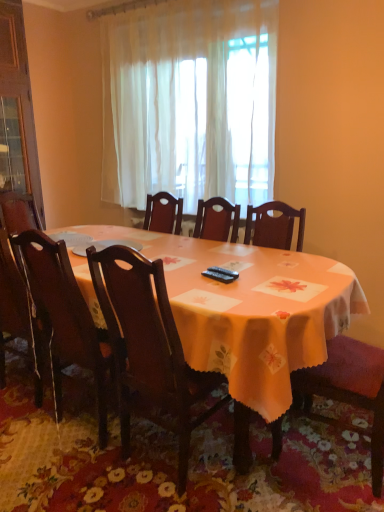
Locate an element on the screen. This screenshot has height=512, width=384. dark wood chair at left, which ranks as the first chair in left-to-right order is located at coordinates (67, 318).

Find the location of a particular element. wooden chair at right, the first chair when ordered from right to left is located at coordinates (348, 388).

Identify the location of dark wood chair at center, the second chair when ordered from right to left. (148, 348).

This screenshot has height=512, width=384. I want to click on dark wood chair at left, the 3th chair positioned from the right, so click(x=67, y=318).

Does floral fabric tablecloth at center contain dark wood chair at left, the 3th chair positioned from the right?

No, dark wood chair at left, the 3th chair positioned from the right, is not surrounded by floral fabric tablecloth at center.

How many degrees apart are the facing directions of floral fabric tablecloth at center and dark wood chair at left, which ranks as the first chair in left-to-right order?

The angular difference between floral fabric tablecloth at center and dark wood chair at left, which ranks as the first chair in left-to-right order, is 180 degrees.

Locate an element on the screen. mat below the dark wood chair at left, which ranks as the first chair in left-to-right order (from the image's perspective) is located at coordinates (176, 459).

Are floral fabric tablecloth at center and dark wood chair at left, the 3th chair positioned from the right, far apart?

No, floral fabric tablecloth at center is not far away from dark wood chair at left, the 3th chair positioned from the right.

From the image's perspective, relative to white sheer curtain at center, is dark wood chair at left, which ranks as the first chair in left-to-right order, above or below?

dark wood chair at left, which ranks as the first chair in left-to-right order, is below white sheer curtain at center.

Which is more to the left, dark wood chair at left, the 3th chair positioned from the right, or white sheer curtain at center?

dark wood chair at left, the 3th chair positioned from the right.

How many degrees apart are the facing directions of dark wood chair at left, which ranks as the first chair in left-to-right order, and white sheer curtain at center?

There is a 180-degree angle between the facing directions of dark wood chair at left, which ranks as the first chair in left-to-right order, and white sheer curtain at center.

What's the angular difference between dark wood chair at left, which ranks as the first chair in left-to-right order, and wooden chair at right, which is counted as the third chair, starting from the left,'s facing directions?

The angle between the facing direction of dark wood chair at left, which ranks as the first chair in left-to-right order, and the facing direction of wooden chair at right, which is counted as the third chair, starting from the left, is 90 degrees.

Between dark wood chair at left, which ranks as the first chair in left-to-right order, and wooden chair at right, which is counted as the third chair, starting from the left, which one appears on the right side from the viewer's perspective?

wooden chair at right, which is counted as the third chair, starting from the left.

Is dark wood chair at left, the 3th chair positioned from the right, inside the boundaries of wooden chair at right, which is counted as the third chair, starting from the left, or outside?

dark wood chair at left, the 3th chair positioned from the right, is not inside wooden chair at right, which is counted as the third chair, starting from the left, it's outside.

Based on the photo, could you tell me if dark wood chair at left, which ranks as the first chair in left-to-right order, is facing wooden chair at right, the first chair when ordered from right to left?

No, dark wood chair at left, which ranks as the first chair in left-to-right order, does not turn towards wooden chair at right, the first chair when ordered from right to left.

Consider the image. Is orange fabric table at center far away from wooden chair at right, which is counted as the third chair, starting from the left?

No, orange fabric table at center is not far away from wooden chair at right, which is counted as the third chair, starting from the left.

From the picture: From a real-world perspective, does orange fabric table at center sit lower than wooden chair at right, the first chair when ordered from right to left?

Correct, in the physical world, orange fabric table at center is lower than wooden chair at right, the first chair when ordered from right to left.

Which object is thinner, orange fabric table at center or wooden chair at right, the first chair when ordered from right to left?

wooden chair at right, the first chair when ordered from right to left, is thinner.

Between white sheer curtain at center and dark wood chair at center, placed as the 2th chair when sorted from left to right, which one is positioned behind?

white sheer curtain at center is further away from the camera.

Could you tell me if white sheer curtain at center is facing dark wood chair at center, the second chair when ordered from right to left?

Yes, white sheer curtain at center faces towards dark wood chair at center, the second chair when ordered from right to left.

Considering the sizes of objects white sheer curtain at center and dark wood chair at center, placed as the 2th chair when sorted from left to right, in the image provided, who is wider, white sheer curtain at center or dark wood chair at center, placed as the 2th chair when sorted from left to right,?

With larger width is dark wood chair at center, placed as the 2th chair when sorted from left to right.

You are a GUI agent. You are given a task and a screenshot of the screen. Output one action in this format:
    pyautogui.click(x=<x>, y=<y>)
    Task: Click on the curtain behind the dark wood chair at center, placed as the 2th chair when sorted from left to right
    This screenshot has width=384, height=512.
    Given the screenshot: What is the action you would take?
    pyautogui.click(x=190, y=102)

Is wooden chair at right, which is counted as the third chair, starting from the left, facing away from dark wood chair at left, the 3th chair positioned from the right?

No, wooden chair at right, which is counted as the third chair, starting from the left,'s orientation is not away from dark wood chair at left, the 3th chair positioned from the right.

Can we say wooden chair at right, the first chair when ordered from right to left, lies outside dark wood chair at left, the 3th chair positioned from the right?

wooden chair at right, the first chair when ordered from right to left, lies outside dark wood chair at left, the 3th chair positioned from the right,'s area.

From a real-world perspective, is wooden chair at right, which is counted as the third chair, starting from the left, above or below dark wood chair at left, the 3th chair positioned from the right?

wooden chair at right, which is counted as the third chair, starting from the left, is situated higher than dark wood chair at left, the 3th chair positioned from the right, in the real world.

Considering the sizes of orange fabric table at center and white sheer curtain at center in the image, is orange fabric table at center taller or shorter than white sheer curtain at center?

orange fabric table at center is shorter than white sheer curtain at center.

How different are the orientations of orange fabric table at center and white sheer curtain at center in degrees?

The facing directions of orange fabric table at center and white sheer curtain at center are 0.212 degrees apart.

I want to click on curtain lying above the orange fabric table at center (from the image's perspective), so [190, 102].

From a real-world perspective, is orange fabric table at center located beneath white sheer curtain at center?

Yes.

What are the coordinates of `chair located on the left of floral fabric tablecloth at center` in the screenshot? It's located at (67, 318).

Where is `curtain above the dark wood chair at left, the 3th chair positioned from the right (from a real-world perspective)`? curtain above the dark wood chair at left, the 3th chair positioned from the right (from a real-world perspective) is located at coordinates (190, 102).

Estimate the real-world distances between objects in this image. Which object is further from wooden chair at right, which is counted as the third chair, starting from the left, white sheer curtain at center or dark wood chair at left, which ranks as the first chair in left-to-right order?

Among the two, white sheer curtain at center is located further to wooden chair at right, which is counted as the third chair, starting from the left.

Which object lies further to the anchor point wooden chair at right, which is counted as the third chair, starting from the left, dark wood chair at center, the second chair when ordered from right to left, or dark wood chair at left, the 3th chair positioned from the right?

dark wood chair at left, the 3th chair positioned from the right, lies further to wooden chair at right, which is counted as the third chair, starting from the left, than the other object.

Consider the image. Which object lies further to the anchor point wooden chair at right, which is counted as the third chair, starting from the left, dark wood chair at center, the second chair when ordered from right to left, or floral fabric tablecloth at center?

dark wood chair at center, the second chair when ordered from right to left, lies further to wooden chair at right, which is counted as the third chair, starting from the left, than the other object.

When comparing their distances from orange fabric table at center, does dark wood chair at center, placed as the 2th chair when sorted from left to right, or wooden chair at right, which is counted as the third chair, starting from the left, seem closer?

dark wood chair at center, placed as the 2th chair when sorted from left to right.

Considering their positions, is floral fabric tablecloth at center positioned further to orange fabric table at center than dark wood chair at left, the 3th chair positioned from the right?

Based on the image, dark wood chair at left, the 3th chair positioned from the right, appears to be further to orange fabric table at center.

Looking at the image, which one is located closer to dark wood chair at left, the 3th chair positioned from the right, wooden chair at right, the first chair when ordered from right to left, or orange fabric table at center?

Based on the image, orange fabric table at center appears to be nearer to dark wood chair at left, the 3th chair positioned from the right.

When comparing their distances from floral fabric tablecloth at center, does wooden chair at right, the first chair when ordered from right to left, or dark wood chair at left, the 3th chair positioned from the right, seem further?

The object further to floral fabric tablecloth at center is dark wood chair at left, the 3th chair positioned from the right.

Estimate the real-world distances between objects in this image. Which object is further from white sheer curtain at center, dark wood chair at center, placed as the 2th chair when sorted from left to right, or orange fabric table at center?

The object further to white sheer curtain at center is dark wood chair at center, placed as the 2th chair when sorted from left to right.

Where is `kitchen & dining room table between white sheer curtain at center and dark wood chair at center, the second chair when ordered from right to left, vertically`? Image resolution: width=384 pixels, height=512 pixels. kitchen & dining room table between white sheer curtain at center and dark wood chair at center, the second chair when ordered from right to left, vertically is located at coordinates (251, 310).

Image resolution: width=384 pixels, height=512 pixels. I want to click on chair between white sheer curtain at center and wooden chair at right, which is counted as the third chair, starting from the left, in the vertical direction, so click(67, 318).

Identify the location of mat located between dark wood chair at left, which ranks as the first chair in left-to-right order, and wooden chair at right, which is counted as the third chair, starting from the left, in the left-right direction. (176, 459).

I want to click on chair between floral fabric tablecloth at center and wooden chair at right, the first chair when ordered from right to left, so click(x=148, y=348).